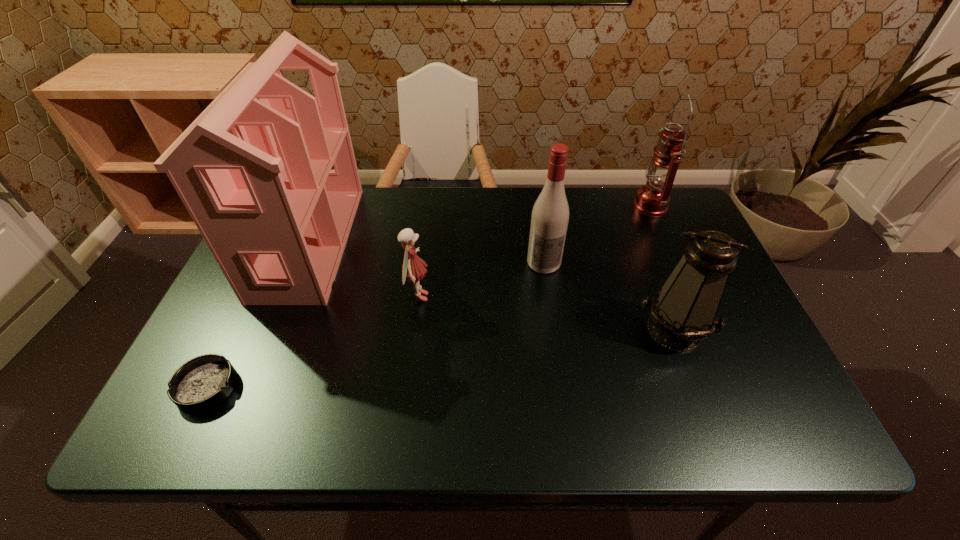
You are a GUI agent. You are given a task and a screenshot of the screen. Output one action in this format:
    pyautogui.click(x=<x>, y=<y>)
    Task: Click on the object located in the far left corner section of the desktop
    Image resolution: width=960 pixels, height=540 pixels.
    Given the screenshot: What is the action you would take?
    pyautogui.click(x=253, y=170)

Where is `object present at the near left corner`? This screenshot has width=960, height=540. object present at the near left corner is located at coordinates pos(202,383).

Identify the location of object that is at the far right corner. (652, 200).

In the image, there is a desktop. Where is `vacant space at the far edge`? This screenshot has height=540, width=960. vacant space at the far edge is located at coordinates (377, 197).

Locate an element on the screen. free space at the near edge is located at coordinates (303, 428).

In the image, there is a desktop. Identify the location of vacant area at the left edge. This screenshot has width=960, height=540. (215, 318).

In the image, there is a desktop. Where is `free space at the right edge`? The width and height of the screenshot is (960, 540). free space at the right edge is located at coordinates (730, 327).

You are a GUI agent. You are given a task and a screenshot of the screen. Output one action in this format:
    pyautogui.click(x=<x>, y=<y>)
    Task: Click on the free spot at the far right corner of the desktop
    Image resolution: width=960 pixels, height=540 pixels.
    Given the screenshot: What is the action you would take?
    pyautogui.click(x=674, y=200)

You are a GUI agent. You are given a task and a screenshot of the screen. Output one action in this format:
    pyautogui.click(x=<x>, y=<y>)
    Task: Click on the free point at the near right corner
    The width and height of the screenshot is (960, 540).
    Given the screenshot: What is the action you would take?
    pyautogui.click(x=802, y=430)

In order to click on unoccupied position between the farther oil lamp and the ashtray in this screenshot , I will do `click(428, 296)`.